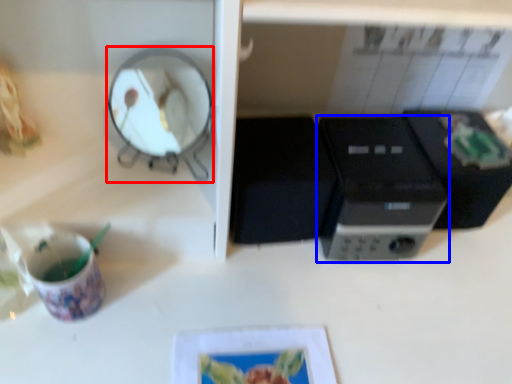
Question: Which object appears closest to the camera in this image, mirror (highlighted by a red box) or home appliance (highlighted by a blue box)?

Choices:
 (A) mirror
 (B) home appliance

Answer: (A)